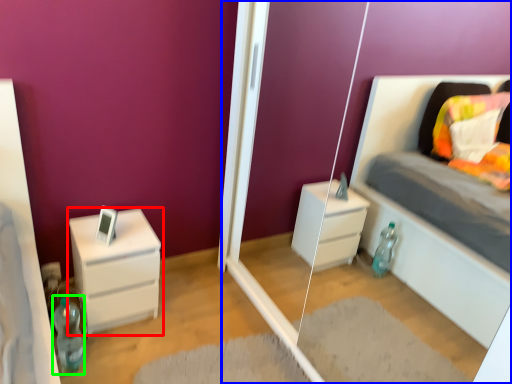
Question: Which is nearer to the chest of drawers (highlighted by a red box)? glass door (highlighted by a blue box) or bottle (highlighted by a green box).

Choices:
 (A) glass door
 (B) bottle

Answer: (B)